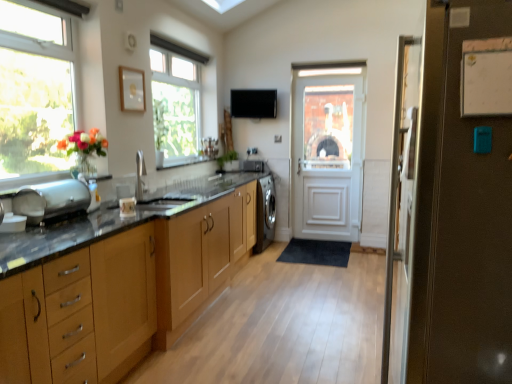
Question: Is point (101, 322) closer or farther from the camera than point (263, 162)?

Choices:
 (A) closer
 (B) farther

Answer: (A)

Question: From a real-world perspective, is wooden cabinet at left, which ranks as the 1th cabinetry in left-to-right order, positioned above or below satin black washing machine at center, the 2th appliance in the bottom-to-top sequence?

Choices:
 (A) above
 (B) below

Answer: (B)

Question: Based on their relative distances, which object is farther from the brown matte refrigerator at right, which is the 2th door in back-to-front order?

Choices:
 (A) clear glass window at left, arranged as the first window when viewed from the front
 (B) black matte exhaust hood at upper center
 (C) wooden cabinet at left, the 2th cabinetry positioned from the right
 (D) white wooden door at center, which is counted as the 2th door, starting from the front
 (E) clear glass window at upper center, which ranks as the first window in back-to-front order

Answer: (B)

Question: Estimate the real-world distances between objects in this image. Which object is closer to the satin black washing machine at center, the second appliance positioned from the front?

Choices:
 (A) white wooden door at center, the first door in the back-to-front sequence
 (B) wooden cabinet at left, the 2th cabinetry when ordered from back to front
 (C) clear glass window at left, arranged as the 2th window when viewed from the right
 (D) black matte exhaust hood at upper center
 (E) wooden cabinets at center, positioned as the first cabinetry in back-to-front order

Answer: (D)